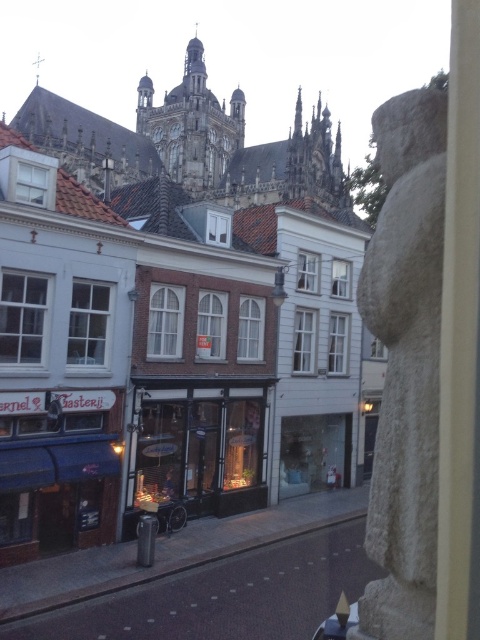
Looking at this image, you are a tourist walking down the street and want to take a photo of both the white brick building at center and the white stone statue at right. Based on their positions, which object should you stand closer to in order to capture both in a single frame?

You should stand closer to the white stone statue at right because the white brick building at center is to the left of the white stone statue at right, so positioning yourself near the statue will allow both objects to be included in the frame.

You are a delivery person trying to park your 1.2 meter wide cart between the white brick building at center and the white stone statue at right. Based on the scene, can you safely park there?

The white brick building at center might be wider than white stone statue at right, so there might not be enough space for the 1.2 meter wide cart between them. Check the actual width before parking.

You are a tourist standing at the entrance of the street. You want to take a photo of both the white stone statue at right and the matte glass storefront at center. Which object should you position to your left to capture both in the frame?

You should position the white stone statue at right to your left since it is to the right of the matte glass storefront at center, so moving it to your left would allow both to be in the frame.